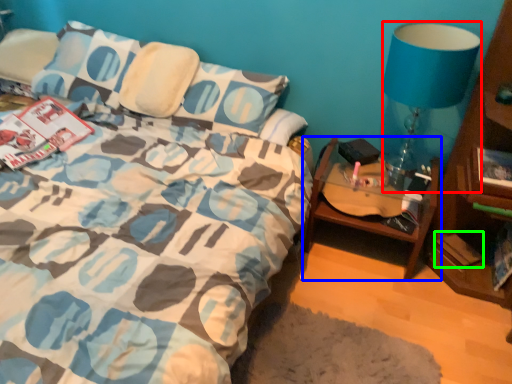
Question: Considering the real-world distances, which object is closest to lamp (highlighted by a red box)? table (highlighted by a blue box) or paperback book (highlighted by a green box).

Choices:
 (A) table
 (B) paperback book

Answer: (A)